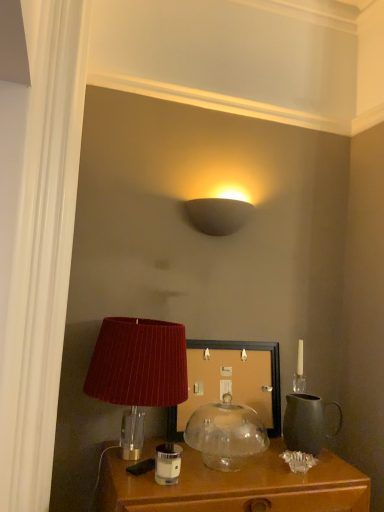
In order to face velvet red lampshade at lower left, arranged as the 2th lamp when viewed from the top, should I rotate leftwards or rightwards?

Turn left approximately 6.882 degrees to face it.

Describe the element at coordinates (226, 434) in the screenshot. This screenshot has width=384, height=512. I see `transparent glass dome at center, the 3th lamp when ordered from top to bottom` at that location.

Measure the distance between matte wooden picture frame at center and camera.

matte wooden picture frame at center and camera are 5.27 feet apart.

The image size is (384, 512). Identify the location of clear glass candle holder at lower center. (167, 463).

This screenshot has width=384, height=512. Find the location of `candle holder that appears on the right of velvet red lampshade at lower left, which is the 2th lamp from bottom to top`. candle holder that appears on the right of velvet red lampshade at lower left, which is the 2th lamp from bottom to top is located at coordinates (167, 463).

Is clear glass candle holder at lower center situated inside velvet red lampshade at lower left, arranged as the 2th lamp when viewed from the top, or outside?

clear glass candle holder at lower center exists outside the volume of velvet red lampshade at lower left, arranged as the 2th lamp when viewed from the top.

Is clear glass candle holder at lower center aimed at velvet red lampshade at lower left, arranged as the 2th lamp when viewed from the top?

No, clear glass candle holder at lower center is not facing towards velvet red lampshade at lower left, arranged as the 2th lamp when viewed from the top.

Would you say clear glass candle holder at lower center is to the left or to the right of velvet red lampshade at lower left, which is the 2th lamp from bottom to top, in the picture?

In the image, clear glass candle holder at lower center appears on the right side of velvet red lampshade at lower left, which is the 2th lamp from bottom to top.

Would you say matte gray wall sconce at upper center, placed as the 1th lamp when sorted from top to bottom, contains matte black pitcher at right?

No.

Is matte gray wall sconce at upper center, marked as the 3th lamp in a bottom-to-top arrangement, at the left side of matte black pitcher at right?

Indeed, matte gray wall sconce at upper center, marked as the 3th lamp in a bottom-to-top arrangement, is positioned on the left side of matte black pitcher at right.

Would you consider matte gray wall sconce at upper center, marked as the 3th lamp in a bottom-to-top arrangement, to be distant from matte black pitcher at right?

No, there isn't a large distance between matte gray wall sconce at upper center, marked as the 3th lamp in a bottom-to-top arrangement, and matte black pitcher at right.

From a real-world perspective, which is physically below, matte gray wall sconce at upper center, placed as the 1th lamp when sorted from top to bottom, or matte black pitcher at right?

matte black pitcher at right, from a real-world perspective.

From the image's perspective, which one is positioned lower, transparent glass dome at center, marked as the first lamp in a bottom-to-top arrangement, or clear glass candle holder at lower center?

clear glass candle holder at lower center.

The height and width of the screenshot is (512, 384). What are the coordinates of `candle holder that appears below the transparent glass dome at center, the 3th lamp when ordered from top to bottom (from the image's perspective)` in the screenshot? It's located at (167, 463).

Based on the photo, what's the angular difference between transparent glass dome at center, marked as the first lamp in a bottom-to-top arrangement, and clear glass candle holder at lower center's facing directions?

The facing directions of transparent glass dome at center, marked as the first lamp in a bottom-to-top arrangement, and clear glass candle holder at lower center are 0.263 degrees apart.

Which object is positioned more to the left, transparent glass dome at center, the 3th lamp when ordered from top to bottom, or clear glass candle holder at lower center?

From the viewer's perspective, clear glass candle holder at lower center appears more on the left side.

Can you confirm if clear glass candle holder at lower center is smaller than transparent glass dome at center, marked as the first lamp in a bottom-to-top arrangement?

Yes, clear glass candle holder at lower center is smaller than transparent glass dome at center, marked as the first lamp in a bottom-to-top arrangement.

Identify the location of lamp that is the 1st object located above the clear glass candle holder at lower center (from the image's perspective). (226, 434).

Is clear glass candle holder at lower center facing away from transparent glass dome at center, marked as the first lamp in a bottom-to-top arrangement?

That's not correct — clear glass candle holder at lower center is not looking away from transparent glass dome at center, marked as the first lamp in a bottom-to-top arrangement.

Is clear glass candle holder at lower center spatially inside transparent glass dome at center, marked as the first lamp in a bottom-to-top arrangement, or outside of it?

The correct answer is: outside.

Is velvet red lampshade at lower left, arranged as the 2th lamp when viewed from the top, inside or outside of matte wooden picture frame at center?

velvet red lampshade at lower left, arranged as the 2th lamp when viewed from the top, cannot be found inside matte wooden picture frame at center.

Relative to matte wooden picture frame at center, is velvet red lampshade at lower left, arranged as the 2th lamp when viewed from the top, in front or behind?

Clearly, velvet red lampshade at lower left, arranged as the 2th lamp when viewed from the top, is in front of matte wooden picture frame at center.

Is point (109, 378) behind point (221, 347)?

No, (109, 378) is in front of (221, 347).

Does point (200, 370) come behind point (238, 211)?

No, it is not.

Can you tell me how much matte wooden picture frame at center and matte gray wall sconce at upper center, placed as the 1th lamp when sorted from top to bottom, differ in facing direction?

They differ by 0.0946 degrees in their facing directions.

Is matte wooden picture frame at center at the right side of matte gray wall sconce at upper center, marked as the 3th lamp in a bottom-to-top arrangement?

Answer: Yes.

Which object is thinner, matte wooden picture frame at center or matte gray wall sconce at upper center, placed as the 1th lamp when sorted from top to bottom?

With smaller width is matte wooden picture frame at center.

From the image's perspective, which one is positioned higher, matte black pitcher at right or velvet red lampshade at lower left, arranged as the 2th lamp when viewed from the top?

velvet red lampshade at lower left, arranged as the 2th lamp when viewed from the top, is shown above in the image.

Measure the distance from matte black pitcher at right to velvet red lampshade at lower left, arranged as the 2th lamp when viewed from the top.

matte black pitcher at right and velvet red lampshade at lower left, arranged as the 2th lamp when viewed from the top, are 54.50 centimeters apart.

Between matte black pitcher at right and velvet red lampshade at lower left, arranged as the 2th lamp when viewed from the top, which one appears on the left side from the viewer's perspective?

velvet red lampshade at lower left, arranged as the 2th lamp when viewed from the top, is more to the left.

Does matte black pitcher at right contain velvet red lampshade at lower left, arranged as the 2th lamp when viewed from the top?

That's incorrect, velvet red lampshade at lower left, arranged as the 2th lamp when viewed from the top, is not inside matte black pitcher at right.

This screenshot has width=384, height=512. In order to click on candle holder that is below the velvet red lampshade at lower left, which is the 2th lamp from bottom to top (from the image's perspective) in this screenshot , I will do (x=167, y=463).

I want to click on tea pot in front of the matte gray wall sconce at upper center, marked as the 3th lamp in a bottom-to-top arrangement, so click(x=306, y=423).

When comparing their distances from velvet red lampshade at lower left, which is the 2th lamp from bottom to top, does matte wooden picture frame at center or transparent glass dome at center, marked as the first lamp in a bottom-to-top arrangement, seem further?

The object further to velvet red lampshade at lower left, which is the 2th lamp from bottom to top, is transparent glass dome at center, marked as the first lamp in a bottom-to-top arrangement.

Based on their spatial positions, is matte gray wall sconce at upper center, placed as the 1th lamp when sorted from top to bottom, or clear glass candle holder at lower center further from matte wooden picture frame at center?

matte gray wall sconce at upper center, placed as the 1th lamp when sorted from top to bottom, is positioned further to the anchor matte wooden picture frame at center.

Estimate the real-world distances between objects in this image. Which object is further from matte black pitcher at right, matte wooden picture frame at center or transparent glass dome at center, the 3th lamp when ordered from top to bottom?

Based on the image, matte wooden picture frame at center appears to be further to matte black pitcher at right.

Considering their positions, is matte wooden picture frame at center positioned closer to clear glass candle holder at lower center than matte gray wall sconce at upper center, marked as the 3th lamp in a bottom-to-top arrangement?

The object closer to clear glass candle holder at lower center is matte wooden picture frame at center.

Based on their spatial positions, is matte black pitcher at right or velvet red lampshade at lower left, which is the 2th lamp from bottom to top, closer to matte wooden picture frame at center?

Based on the image, matte black pitcher at right appears to be nearer to matte wooden picture frame at center.

Which object lies further to the anchor point transparent glass dome at center, marked as the first lamp in a bottom-to-top arrangement, matte wooden picture frame at center or velvet red lampshade at lower left, which is the 2th lamp from bottom to top?

Based on the image, velvet red lampshade at lower left, which is the 2th lamp from bottom to top, appears to be further to transparent glass dome at center, marked as the first lamp in a bottom-to-top arrangement.

Which object lies nearer to the anchor point matte gray wall sconce at upper center, marked as the 3th lamp in a bottom-to-top arrangement, matte black pitcher at right or clear glass candle holder at lower center?

Among the two, matte black pitcher at right is located nearer to matte gray wall sconce at upper center, marked as the 3th lamp in a bottom-to-top arrangement.

Considering their positions, is matte wooden picture frame at center positioned further to transparent glass dome at center, marked as the first lamp in a bottom-to-top arrangement, than matte black pitcher at right?

matte black pitcher at right lies further to transparent glass dome at center, marked as the first lamp in a bottom-to-top arrangement, than the other object.

Identify the location of picture frame between velvet red lampshade at lower left, which is the 2th lamp from bottom to top, and matte black pitcher at right, in the horizontal direction. [x=232, y=381].

Locate an element on the screen. candle holder between velvet red lampshade at lower left, arranged as the 2th lamp when viewed from the top, and matte black pitcher at right from left to right is located at coordinates (167, 463).

Find the location of a particular element. Image resolution: width=384 pixels, height=512 pixels. picture frame located between velvet red lampshade at lower left, which is the 2th lamp from bottom to top, and transparent glass dome at center, marked as the first lamp in a bottom-to-top arrangement, in the left-right direction is located at coordinates (232, 381).

Image resolution: width=384 pixels, height=512 pixels. I want to click on lamp between matte gray wall sconce at upper center, marked as the 3th lamp in a bottom-to-top arrangement, and matte wooden picture frame at center, in the vertical direction, so click(x=138, y=371).